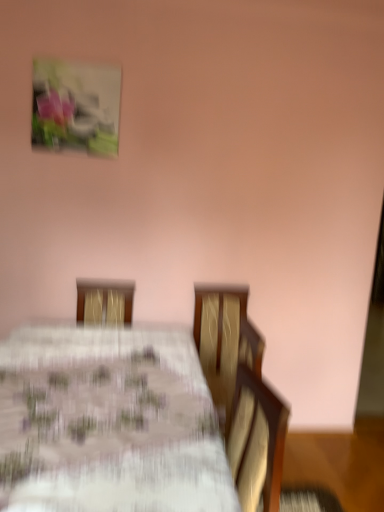
Question: Considering the relative positions of matte plastic picture frame at upper left and white floral tablecloth at center in the image provided, is matte plastic picture frame at upper left to the left or to the right of white floral tablecloth at center?

Choices:
 (A) right
 (B) left

Answer: (B)

Question: In terms of size, does matte plastic picture frame at upper left appear bigger or smaller than white floral tablecloth at center?

Choices:
 (A) small
 (B) big

Answer: (A)

Question: From the image's perspective, is matte plastic picture frame at upper left above or below white floral tablecloth at center?

Choices:
 (A) below
 (B) above

Answer: (B)

Question: Is white floral tablecloth at center inside the boundaries of matte plastic picture frame at upper left, or outside?

Choices:
 (A) outside
 (B) inside

Answer: (A)

Question: In terms of width, does white floral tablecloth at center look wider or thinner when compared to matte plastic picture frame at upper left?

Choices:
 (A) thin
 (B) wide

Answer: (B)

Question: Is white floral tablecloth at center in front of or behind matte plastic picture frame at upper left in the image?

Choices:
 (A) behind
 (B) front

Answer: (B)

Question: Does point (89, 445) appear closer or farther from the camera than point (97, 155)?

Choices:
 (A) closer
 (B) farther

Answer: (A)